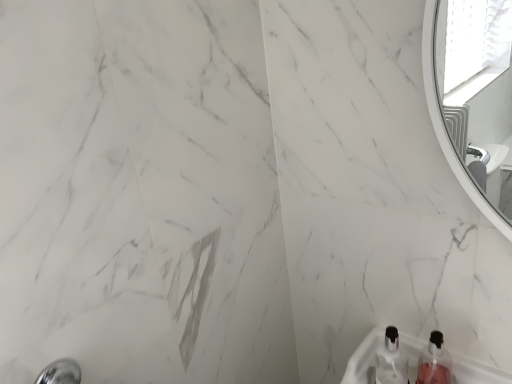
What do you see at coordinates (391, 360) in the screenshot? The image size is (512, 384). I see `clear plastic bottle at lower center, which is the first bottle in left-to-right order` at bounding box center [391, 360].

You are a GUI agent. You are given a task and a screenshot of the screen. Output one action in this format:
    pyautogui.click(x=<x>, y=<y>)
    Task: Click on the clear plastic bottle at lower center, which is the first bottle in left-to-right order
    
    Given the screenshot: What is the action you would take?
    pyautogui.click(x=391, y=360)

What is the approximate height of clear plastic bottle at lower center, acting as the 2th bottle starting from the right?

The height of clear plastic bottle at lower center, acting as the 2th bottle starting from the right, is 14.93 centimeters.

You are a GUI agent. You are given a task and a screenshot of the screen. Output one action in this format:
    pyautogui.click(x=<x>, y=<y>)
    Task: Click on the pink translucent bottle at lower right, the first bottle viewed from the right
    The height and width of the screenshot is (384, 512).
    Given the screenshot: What is the action you would take?
    pyautogui.click(x=434, y=362)

The height and width of the screenshot is (384, 512). What do you see at coordinates (434, 362) in the screenshot? I see `pink translucent bottle at lower right, the second bottle when ordered from left to right` at bounding box center [434, 362].

At what (x,y) coordinates should I click in order to perform the action: click on clear plastic bottle at lower center, acting as the 2th bottle starting from the right. Please return your answer as a coordinate pair (x, y). The width and height of the screenshot is (512, 384). Looking at the image, I should click on (391, 360).

Between clear plastic bottle at lower center, acting as the 2th bottle starting from the right, and pink translucent bottle at lower right, the second bottle when ordered from left to right, which one appears on the right side from the viewer's perspective?

pink translucent bottle at lower right, the second bottle when ordered from left to right.

Is clear plastic bottle at lower center, which is the first bottle in left-to-right order, further to the viewer compared to pink translucent bottle at lower right, the first bottle viewed from the right?

Yes, clear plastic bottle at lower center, which is the first bottle in left-to-right order, is further from the camera.

Which point is more forward, (398,365) or (445,355)?

The point (398,365) is in front.

From the image's perspective, would you say clear plastic bottle at lower center, which is the first bottle in left-to-right order, is shown under pink translucent bottle at lower right, the first bottle viewed from the right?

No, from the image's perspective, clear plastic bottle at lower center, which is the first bottle in left-to-right order, is not below pink translucent bottle at lower right, the first bottle viewed from the right.

Consider the image. From a real-world perspective, is clear plastic bottle at lower center, acting as the 2th bottle starting from the right, beneath pink translucent bottle at lower right, the first bottle viewed from the right?

Actually, clear plastic bottle at lower center, acting as the 2th bottle starting from the right, is physically above pink translucent bottle at lower right, the first bottle viewed from the right, in the real world.

Considering the relative sizes of clear plastic bottle at lower center, acting as the 2th bottle starting from the right, and pink translucent bottle at lower right, the second bottle when ordered from left to right, in the image provided, is clear plastic bottle at lower center, acting as the 2th bottle starting from the right, thinner than pink translucent bottle at lower right, the second bottle when ordered from left to right,?

Yes, clear plastic bottle at lower center, acting as the 2th bottle starting from the right, is thinner than pink translucent bottle at lower right, the second bottle when ordered from left to right.

Who is taller, clear plastic bottle at lower center, which is the first bottle in left-to-right order, or pink translucent bottle at lower right, the second bottle when ordered from left to right?

With more height is clear plastic bottle at lower center, which is the first bottle in left-to-right order.

Is clear plastic bottle at lower center, acting as the 2th bottle starting from the right, bigger than pink translucent bottle at lower right, the first bottle viewed from the right?

Correct, clear plastic bottle at lower center, acting as the 2th bottle starting from the right, is larger in size than pink translucent bottle at lower right, the first bottle viewed from the right.

Can we say clear plastic bottle at lower center, which is the first bottle in left-to-right order, lies outside pink translucent bottle at lower right, the first bottle viewed from the right?

clear plastic bottle at lower center, which is the first bottle in left-to-right order, is positioned outside pink translucent bottle at lower right, the first bottle viewed from the right.

Are clear plastic bottle at lower center, which is the first bottle in left-to-right order, and pink translucent bottle at lower right, the first bottle viewed from the right, located far from each other?

They are positioned close to each other.

Does clear plastic bottle at lower center, acting as the 2th bottle starting from the right, turn towards pink translucent bottle at lower right, the second bottle when ordered from left to right?

No, clear plastic bottle at lower center, acting as the 2th bottle starting from the right, is not aimed at pink translucent bottle at lower right, the second bottle when ordered from left to right.

At what (x,y) coordinates should I click in order to perform the action: click on bottle behind the pink translucent bottle at lower right, the first bottle viewed from the right. Please return your answer as a coordinate pair (x, y). Image resolution: width=512 pixels, height=384 pixels. Looking at the image, I should click on (391, 360).

Is pink translucent bottle at lower right, the first bottle viewed from the right, at the left side of clear plastic bottle at lower center, which is the first bottle in left-to-right order?

Incorrect, pink translucent bottle at lower right, the first bottle viewed from the right, is not on the left side of clear plastic bottle at lower center, which is the first bottle in left-to-right order.

From the picture: Which object is further away from the camera taking this photo, pink translucent bottle at lower right, the first bottle viewed from the right, or clear plastic bottle at lower center, acting as the 2th bottle starting from the right?

clear plastic bottle at lower center, acting as the 2th bottle starting from the right, is further from the camera.

Is point (429, 374) closer or farther from the camera than point (405, 380)?

Point (429, 374).

From the image's perspective, which is above, pink translucent bottle at lower right, the first bottle viewed from the right, or clear plastic bottle at lower center, acting as the 2th bottle starting from the right?

clear plastic bottle at lower center, acting as the 2th bottle starting from the right, appears higher in the image.

From the picture: From a real-world perspective, which is physically below, pink translucent bottle at lower right, the second bottle when ordered from left to right, or clear plastic bottle at lower center, which is the first bottle in left-to-right order?

pink translucent bottle at lower right, the second bottle when ordered from left to right, from a real-world perspective.

Considering the sizes of objects pink translucent bottle at lower right, the second bottle when ordered from left to right, and clear plastic bottle at lower center, acting as the 2th bottle starting from the right, in the image provided, who is thinner, pink translucent bottle at lower right, the second bottle when ordered from left to right, or clear plastic bottle at lower center, acting as the 2th bottle starting from the right,?

Thinner between the two is clear plastic bottle at lower center, acting as the 2th bottle starting from the right.

Which of these two, pink translucent bottle at lower right, the second bottle when ordered from left to right, or clear plastic bottle at lower center, which is the first bottle in left-to-right order, stands shorter?

pink translucent bottle at lower right, the second bottle when ordered from left to right, is shorter.

Considering the relative sizes of pink translucent bottle at lower right, the second bottle when ordered from left to right, and clear plastic bottle at lower center, acting as the 2th bottle starting from the right, in the image provided, is pink translucent bottle at lower right, the second bottle when ordered from left to right, bigger than clear plastic bottle at lower center, acting as the 2th bottle starting from the right,?

No, pink translucent bottle at lower right, the second bottle when ordered from left to right, is not bigger than clear plastic bottle at lower center, acting as the 2th bottle starting from the right.

Can we say pink translucent bottle at lower right, the first bottle viewed from the right, lies outside clear plastic bottle at lower center, which is the first bottle in left-to-right order?

pink translucent bottle at lower right, the first bottle viewed from the right, is positioned outside clear plastic bottle at lower center, which is the first bottle in left-to-right order.

In the scene shown: Is pink translucent bottle at lower right, the second bottle when ordered from left to right, in contact with clear plastic bottle at lower center, which is the first bottle in left-to-right order?

Yes, pink translucent bottle at lower right, the second bottle when ordered from left to right, and clear plastic bottle at lower center, which is the first bottle in left-to-right order, clearly make contact.

Is pink translucent bottle at lower right, the second bottle when ordered from left to right, oriented towards clear plastic bottle at lower center, acting as the 2th bottle starting from the right?

No, pink translucent bottle at lower right, the second bottle when ordered from left to right, is not oriented towards clear plastic bottle at lower center, acting as the 2th bottle starting from the right.

What's the angular difference between pink translucent bottle at lower right, the second bottle when ordered from left to right, and clear plastic bottle at lower center, which is the first bottle in left-to-right order,'s facing directions?

pink translucent bottle at lower right, the second bottle when ordered from left to right, and clear plastic bottle at lower center, which is the first bottle in left-to-right order, are facing 0.00278 degrees away from each other.

Find the location of a particular element. Image resolution: width=512 pixels, height=384 pixels. bottle located above the pink translucent bottle at lower right, the first bottle viewed from the right (from the image's perspective) is located at coordinates [x=391, y=360].

The image size is (512, 384). Identify the location of bottle lying above the pink translucent bottle at lower right, the second bottle when ordered from left to right (from the image's perspective). (391, 360).

Identify the location of bottle that appears below the clear plastic bottle at lower center, which is the first bottle in left-to-right order (from a real-world perspective). (434, 362).